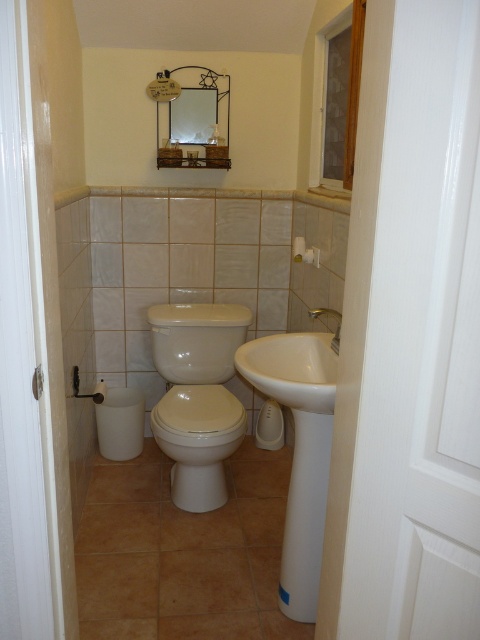
Question: Which point is farther to the camera?

Choices:
 (A) white glossy toilet at center
 (B) silver metallic faucet at upper right
 (C) white ceramic sink at center

Answer: (A)

Question: Can you confirm if white glossy toilet at center is positioned to the left of silver metallic faucet at upper right?

Choices:
 (A) no
 (B) yes

Answer: (B)

Question: Observing the image, what is the correct spatial positioning of white ceramic sink at center in reference to white glossy toilet at center?

Choices:
 (A) below
 (B) above

Answer: (B)

Question: Can you confirm if white glossy toilet at center is smaller than silver metallic faucet at upper right?

Choices:
 (A) no
 (B) yes

Answer: (A)

Question: Estimate the real-world distances between objects in this image. Which object is farther from the white ceramic sink at center?

Choices:
 (A) white glossy toilet at center
 (B) silver metallic faucet at upper right

Answer: (A)

Question: Which of these objects is positioned farthest from the silver metallic faucet at upper right?

Choices:
 (A) white ceramic sink at center
 (B) white glossy toilet at center

Answer: (B)